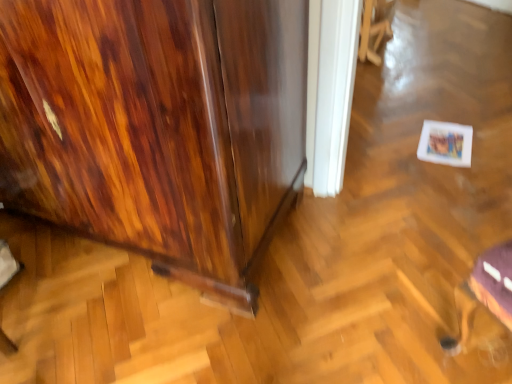
This screenshot has height=384, width=512. I want to click on vacant space behind metallic silver swivel chair at lower right, arranged as the 2th swivel chair when viewed from the top, so click(x=430, y=278).